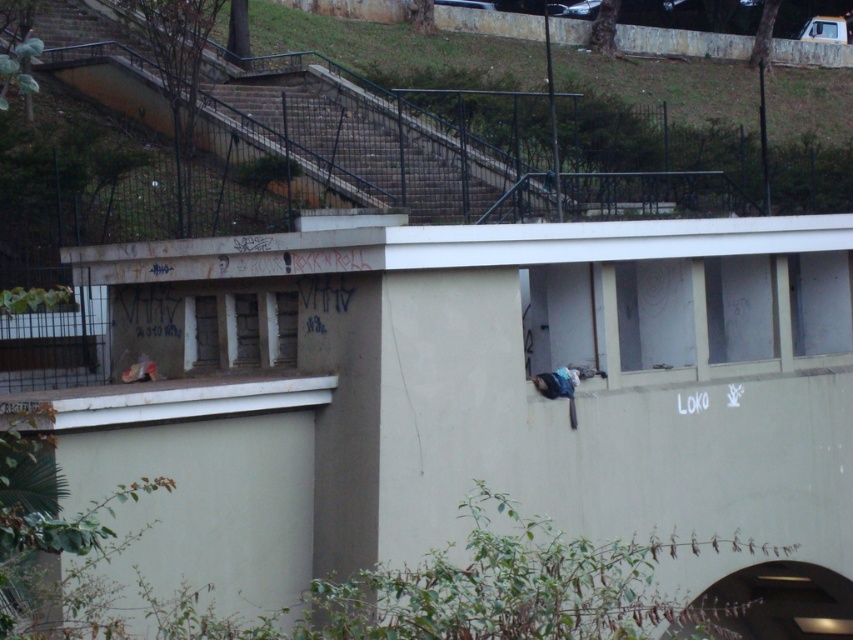
Is metallic gray stairs at upper center below transparent glass window at upper center?

Actually, metallic gray stairs at upper center is above transparent glass window at upper center.

Describe the element at coordinates (380, 141) in the screenshot. I see `metallic gray stairs at upper center` at that location.

The width and height of the screenshot is (853, 640). Describe the element at coordinates (380, 141) in the screenshot. I see `metallic gray stairs at upper center` at that location.

Identify the location of metallic gray stairs at upper center. This screenshot has height=640, width=853. pos(380,141).

Is concrete stairs at upper center thinner than transparent glass window at upper right?

No, concrete stairs at upper center is not thinner than transparent glass window at upper right.

Does concrete stairs at upper center lie behind transparent glass window at upper right?

No, it is in front of transparent glass window at upper right.

Measure the distance between concrete stairs at upper center and camera.

The distance of concrete stairs at upper center from camera is 23.14 meters.

The height and width of the screenshot is (640, 853). In order to click on concrete stairs at upper center in this screenshot , I will do `click(320, 134)`.

Is metallic gray stairs at upper center shorter than transparent glass window at upper right?

Incorrect, metallic gray stairs at upper center's height does not fall short of transparent glass window at upper right's.

Does metallic gray stairs at upper center come behind transparent glass window at upper right?

Yes, metallic gray stairs at upper center is further from the viewer.

Does point (316, 70) come in front of point (801, 337)?

No, (316, 70) is behind (801, 337).

The width and height of the screenshot is (853, 640). I want to click on metallic gray stairs at upper center, so click(x=380, y=141).